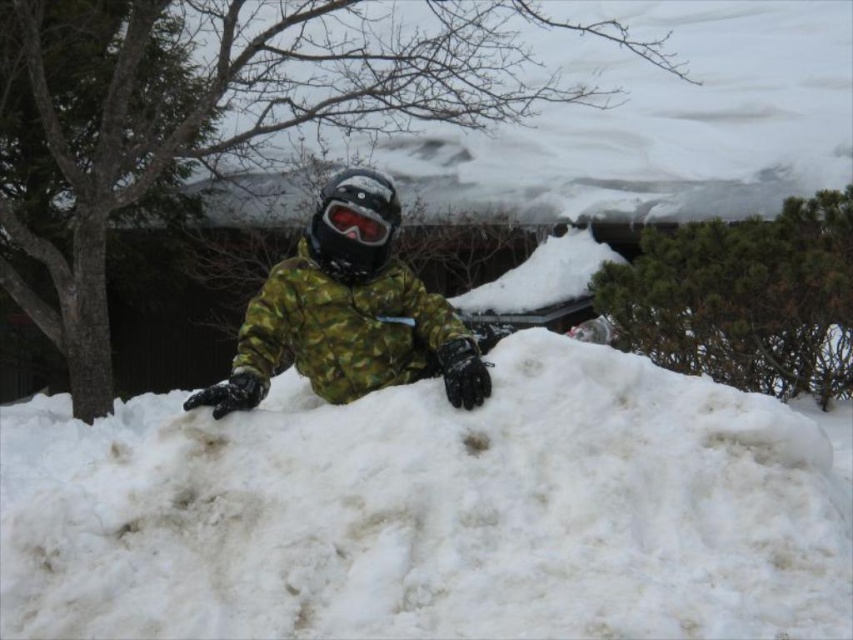
Who is positioned more to the right, white fluffy snow at center or matte black goggles at center?

Positioned to the right is white fluffy snow at center.

Which is below, white fluffy snow at center or matte black goggles at center?

white fluffy snow at center is lower down.

The height and width of the screenshot is (640, 853). I want to click on white fluffy snow at center, so click(x=432, y=512).

At what (x,y) coordinates should I click in order to perform the action: click on white fluffy snow at center. Please return your answer as a coordinate pair (x, y). Looking at the image, I should click on (432, 512).

Who is taller, camo fabric jacket at center or matte black goggles at center?

camo fabric jacket at center is taller.

Between point (332, 188) and point (345, 225), which one is positioned in front?

Point (345, 225)

Locate an element on the screen. The height and width of the screenshot is (640, 853). camo fabric jacket at center is located at coordinates (347, 317).

Looking at this image, who is more distant from viewer, (641,385) or (231,403)?

Positioned behind is point (641,385).

Can you confirm if white fluffy snow at center is smaller than camo fabric jacket at center?

Incorrect, white fluffy snow at center is not smaller in size than camo fabric jacket at center.

Measure the distance between point (157,516) and camera.

A distance of 4.63 meters exists between point (157,516) and camera.

Where is `white fluffy snow at center`? This screenshot has width=853, height=640. white fluffy snow at center is located at coordinates (432, 512).